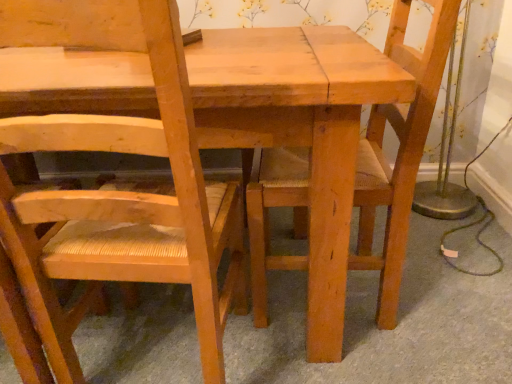
Describe the element at coordinates (399, 151) in the screenshot. The width and height of the screenshot is (512, 384). I see `natural wood chair at center, arranged as the 2th chair when viewed from the left` at that location.

Measure the distance between point (380, 154) and camera.

They are 3.88 feet apart.

I want to click on natural wood chair at center, which ranks as the 1th chair in right-to-left order, so click(x=399, y=151).

The width and height of the screenshot is (512, 384). What are the coordinates of `natural wood chair at left, acting as the 2th chair starting from the right` in the screenshot? It's located at (118, 189).

This screenshot has width=512, height=384. What do you see at coordinates (118, 189) in the screenshot? I see `natural wood chair at left, acting as the 2th chair starting from the right` at bounding box center [118, 189].

Locate an element on the screen. This screenshot has width=512, height=384. natural wood chair at center, which ranks as the 1th chair in right-to-left order is located at coordinates (399, 151).

Is natural wood chair at center, arranged as the 2th chair when viewed from the left, to the left of natural wood chair at left, acting as the 2th chair starting from the right, from the viewer's perspective?

No.

Relative to natural wood chair at left, the 1th chair when ordered from left to right, is natural wood chair at center, arranged as the 2th chair when viewed from the left, in front or behind?

natural wood chair at center, arranged as the 2th chair when viewed from the left, is positioned farther from the viewer than natural wood chair at left, the 1th chair when ordered from left to right.

Is point (423, 124) closer or farther from the camera than point (174, 24)?

Point (423, 124) is positioned farther from the camera compared to point (174, 24).

From the image's perspective, is natural wood chair at center, which ranks as the 1th chair in right-to-left order, above natural wood chair at left, the 1th chair when ordered from left to right?

Yes, from the image's perspective, natural wood chair at center, which ranks as the 1th chair in right-to-left order, is above natural wood chair at left, the 1th chair when ordered from left to right.

From a real-world perspective, is natural wood chair at center, arranged as the 2th chair when viewed from the left, positioned above or below natural wood chair at left, the 1th chair when ordered from left to right?

natural wood chair at center, arranged as the 2th chair when viewed from the left, is situated lower than natural wood chair at left, the 1th chair when ordered from left to right, in the real world.

Looking at this image, which object is wider, natural wood chair at center, which ranks as the 1th chair in right-to-left order, or natural wood chair at left, the 1th chair when ordered from left to right?

Wider between the two is natural wood chair at center, which ranks as the 1th chair in right-to-left order.

Consider the image. Which of these two, natural wood chair at center, which ranks as the 1th chair in right-to-left order, or natural wood chair at left, the 1th chair when ordered from left to right, stands taller?

natural wood chair at left, the 1th chair when ordered from left to right.

Between natural wood chair at center, which ranks as the 1th chair in right-to-left order, and natural wood chair at left, acting as the 2th chair starting from the right, which one has larger size?

Bigger between the two is natural wood chair at center, which ranks as the 1th chair in right-to-left order.

Is natural wood chair at center, arranged as the 2th chair when viewed from the left, not inside natural wood chair at left, the 1th chair when ordered from left to right?

That's correct, natural wood chair at center, arranged as the 2th chair when viewed from the left, is outside of natural wood chair at left, the 1th chair when ordered from left to right.

Is natural wood chair at center, which ranks as the 1th chair in right-to-left order, far from natural wood chair at left, the 1th chair when ordered from left to right?

No.

Is natural wood chair at center, which ranks as the 1th chair in right-to-left order, oriented away from natural wood chair at left, acting as the 2th chair starting from the right?

No, natural wood chair at left, acting as the 2th chair starting from the right, is not at the back of natural wood chair at center, which ranks as the 1th chair in right-to-left order.

Where is `chair above the natural wood chair at center, arranged as the 2th chair when viewed from the left (from a real-world perspective)`? chair above the natural wood chair at center, arranged as the 2th chair when viewed from the left (from a real-world perspective) is located at coordinates (118, 189).

Does natural wood chair at left, acting as the 2th chair starting from the right, appear on the left side of natural wood chair at center, which ranks as the 1th chair in right-to-left order?

Yes, natural wood chair at left, acting as the 2th chair starting from the right, is to the left of natural wood chair at center, which ranks as the 1th chair in right-to-left order.

In the image, is natural wood chair at left, acting as the 2th chair starting from the right, positioned in front of or behind natural wood chair at center, arranged as the 2th chair when viewed from the left?

In the image, natural wood chair at left, acting as the 2th chair starting from the right, appears in front of natural wood chair at center, arranged as the 2th chair when viewed from the left.

Does point (110, 240) come farther from viewer compared to point (430, 29)?

No, it is in front of (430, 29).

From the image's perspective, relative to natural wood chair at center, which ranks as the 1th chair in right-to-left order, is natural wood chair at left, acting as the 2th chair starting from the right, above or below?

natural wood chair at left, acting as the 2th chair starting from the right, is below natural wood chair at center, which ranks as the 1th chair in right-to-left order.

From a real-world perspective, which object rests below the other?

In real-world perspective, natural wood chair at center, arranged as the 2th chair when viewed from the left, is lower.

Between natural wood chair at left, acting as the 2th chair starting from the right, and natural wood chair at center, arranged as the 2th chair when viewed from the left, which one has smaller width?

natural wood chair at left, acting as the 2th chair starting from the right.

Who is taller, natural wood chair at left, the 1th chair when ordered from left to right, or natural wood chair at center, which ranks as the 1th chair in right-to-left order?

With more height is natural wood chair at left, the 1th chair when ordered from left to right.

Based on their sizes in the image, would you say natural wood chair at left, acting as the 2th chair starting from the right, is bigger or smaller than natural wood chair at center, arranged as the 2th chair when viewed from the left?

In the image, natural wood chair at left, acting as the 2th chair starting from the right, appears to be smaller than natural wood chair at center, arranged as the 2th chair when viewed from the left.

Would you say natural wood chair at left, acting as the 2th chair starting from the right, is outside natural wood chair at center, arranged as the 2th chair when viewed from the left?

natural wood chair at left, acting as the 2th chair starting from the right, is positioned outside natural wood chair at center, arranged as the 2th chair when viewed from the left.

Is natural wood chair at left, acting as the 2th chair starting from the right, far from natural wood chair at center, arranged as the 2th chair when viewed from the left?

No, natural wood chair at left, acting as the 2th chair starting from the right, is in close proximity to natural wood chair at center, arranged as the 2th chair when viewed from the left.

Does natural wood chair at left, the 1th chair when ordered from left to right, turn towards natural wood chair at center, which ranks as the 1th chair in right-to-left order?

No.

How much distance is there between natural wood chair at left, the 1th chair when ordered from left to right, and natural wood chair at center, arranged as the 2th chair when viewed from the left?

The distance of natural wood chair at left, the 1th chair when ordered from left to right, from natural wood chair at center, arranged as the 2th chair when viewed from the left, is 13.84 inches.

The width and height of the screenshot is (512, 384). In order to click on chair located on the left of natural wood chair at center, which ranks as the 1th chair in right-to-left order in this screenshot , I will do `click(118, 189)`.

Identify the location of chair that is above the natural wood chair at left, acting as the 2th chair starting from the right (from the image's perspective). (399, 151).

Image resolution: width=512 pixels, height=384 pixels. In order to click on chair beneath the natural wood chair at left, the 1th chair when ordered from left to right (from a real-world perspective) in this screenshot , I will do `click(399, 151)`.